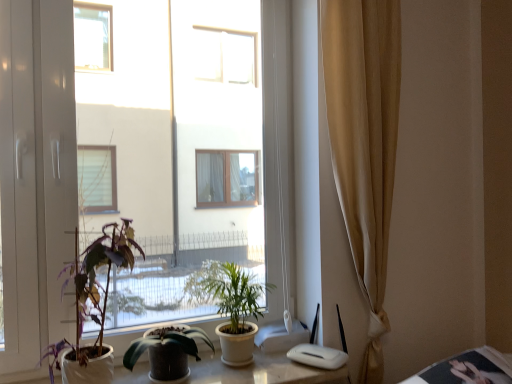
Question: Do you think transparent glass window at center is within beige fabric curtain at right, or outside of it?

Choices:
 (A) outside
 (B) inside

Answer: (A)

Question: In the image, is transparent glass window at center positioned in front of or behind beige fabric curtain at right?

Choices:
 (A) front
 (B) behind

Answer: (A)

Question: Which is farther from the purple matte plant at left, arranged as the first houseplant when viewed from the left?

Choices:
 (A) green leafy plant at center, arranged as the 3th houseplant when viewed from the left
 (B) beige fabric curtain at right
 (C) green glossy plant at center, marked as the second houseplant in a left-to-right arrangement
 (D) white glossy table at lower right
 (E) transparent glass window at center

Answer: (D)

Question: Which of these objects is positioned farthest from the green leafy plant at center, which ranks as the 1th houseplant in right-to-left order?

Choices:
 (A) beige fabric curtain at right
 (B) white glossy table at lower right
 (C) purple matte plant at left, arranged as the first houseplant when viewed from the left
 (D) transparent glass window at center
 (E) green glossy plant at center, marked as the second houseplant in a left-to-right arrangement

Answer: (B)